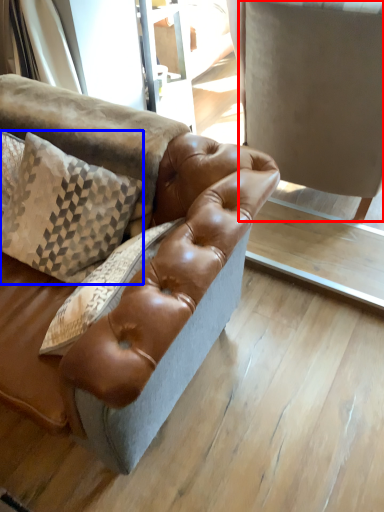
Question: Among these objects, which one is farthest to the camera, swivel chair (highlighted by a red box) or pillow (highlighted by a blue box)?

Choices:
 (A) swivel chair
 (B) pillow

Answer: (A)